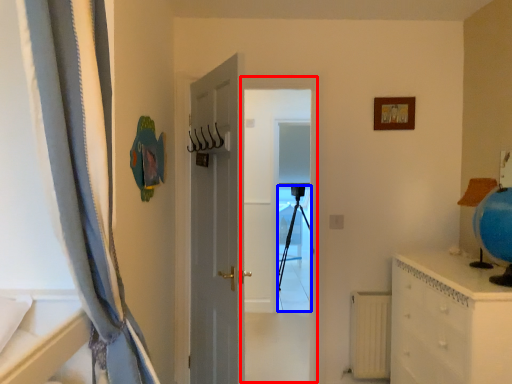
Question: Which object is closer to the camera taking this photo, screen door (highlighted by a red box) or tripod (highlighted by a blue box)?

Choices:
 (A) screen door
 (B) tripod

Answer: (A)